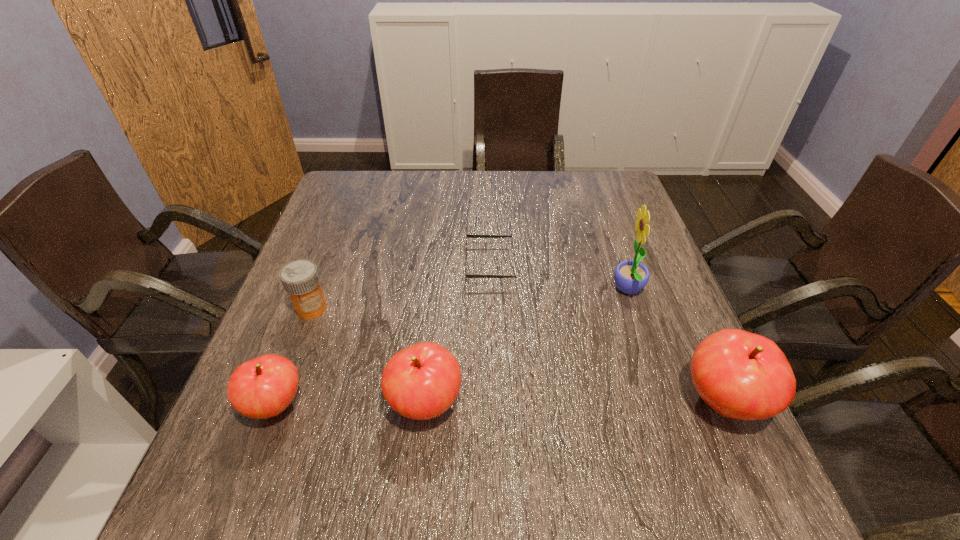
At what (x,y) coordinates should I click in order to perform the action: click on sunflower that is positioned at the right edge. Please return your answer as a coordinate pair (x, y). Looking at the image, I should click on (630, 277).

This screenshot has height=540, width=960. In order to click on object present at the near left corner in this screenshot , I will do `click(263, 387)`.

This screenshot has width=960, height=540. Find the location of `object located in the near right corner section of the desktop`. object located in the near right corner section of the desktop is located at coordinates click(741, 375).

Locate an element on the screen. free spot at the far edge of the desktop is located at coordinates (443, 213).

Find the location of a particular element. free point at the near edge is located at coordinates click(597, 446).

I want to click on vacant area at the left edge, so click(348, 242).

In the image, there is a desktop. In order to click on vacant space at the right edge in this screenshot , I will do `click(629, 230)`.

You are a GUI agent. You are given a task and a screenshot of the screen. Output one action in this format:
    pyautogui.click(x=<x>, y=<y>)
    Task: Click on the vacant region at the far right corner of the desktop
    
    Given the screenshot: What is the action you would take?
    pyautogui.click(x=589, y=187)

You are a GUI agent. You are given a task and a screenshot of the screen. Output one action in this format:
    pyautogui.click(x=<x>, y=<y>)
    Task: Click on the vacant area at the near right corner
    
    Given the screenshot: What is the action you would take?
    [721, 422]

Locate an element on the screen. This screenshot has height=540, width=960. free space between the rightmost apple and the medicine is located at coordinates (517, 355).